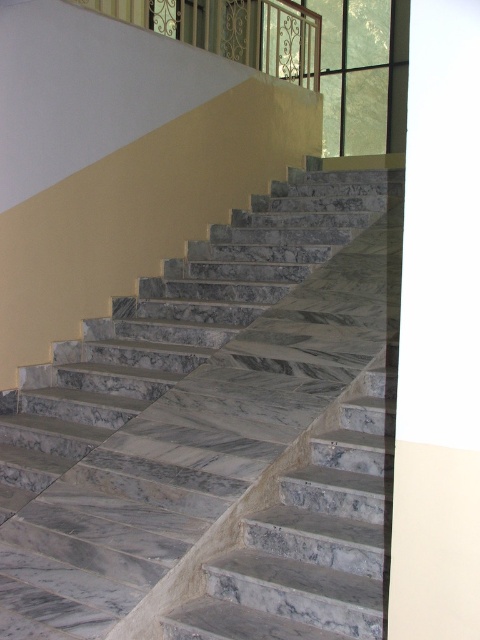
Based on the photo, you are an interior designer assessing the space for a new chandelier. You see the marble stairs at center and the metallic wrought iron at upper center. Which object would you consider larger in size when planning the placement of the chandelier?

The marble stairs at center is bigger than the metallic wrought iron at upper center, so the marble stairs at center would be the larger object to consider for chandelier placement.